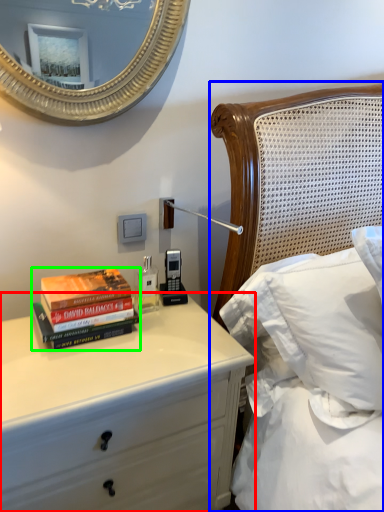
Question: Which object is positioned closest to chest of drawers (highlighted by a red box)? Select from bed (highlighted by a blue box) and book (highlighted by a green box).

Choices:
 (A) bed
 (B) book

Answer: (B)